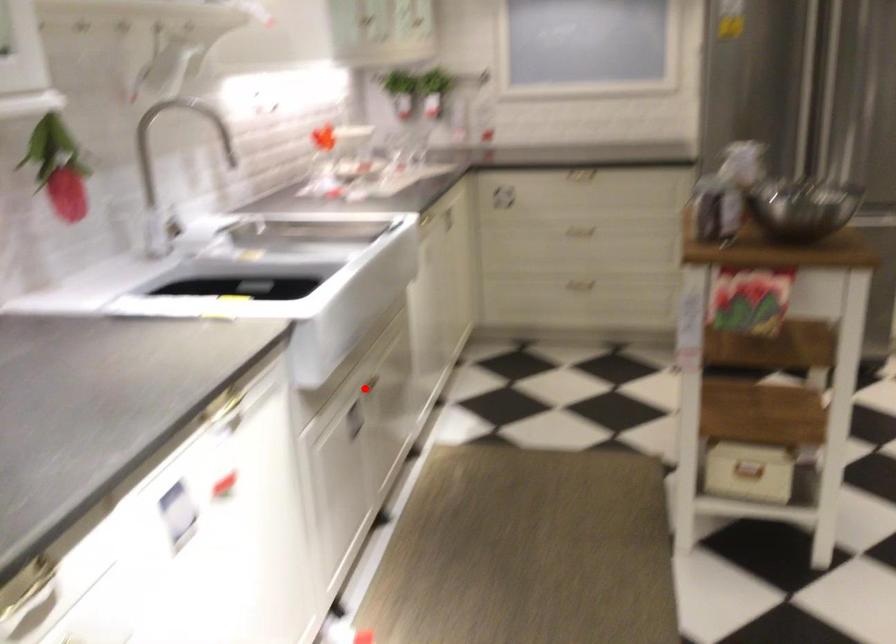
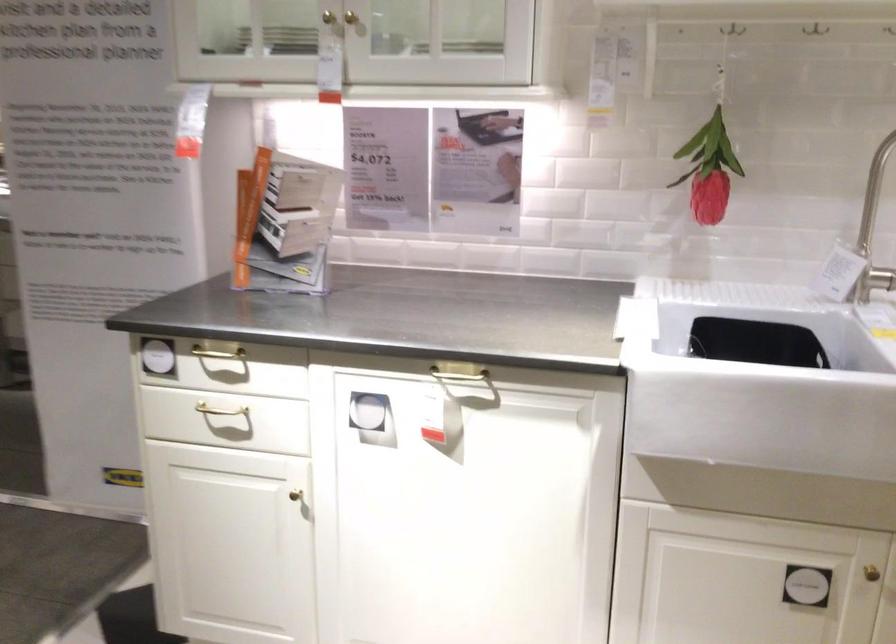
Locate, in the second image, the point that corresponds to the highlighted location in the first image.

(871, 573)